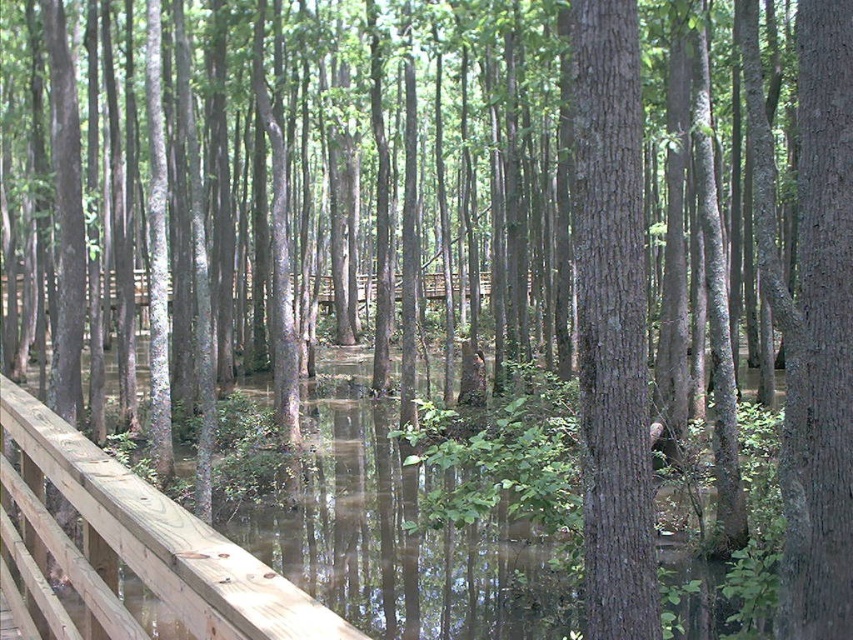
You are standing on the wooden boardwalk in the swamp. You notice a point marked at coordinates (611, 321). What object is located at this point?

The point at (611, 321) marks the location of the smooth brown tree trunk at center.

You are standing on the wooden boardwalk and want to compare the sizes of the objects around you. Which object, the smooth brown tree trunk at center or the light brown wooden rail at left, is smaller?

The smooth brown tree trunk at center is smaller than the light brown wooden rail at left according to the description.